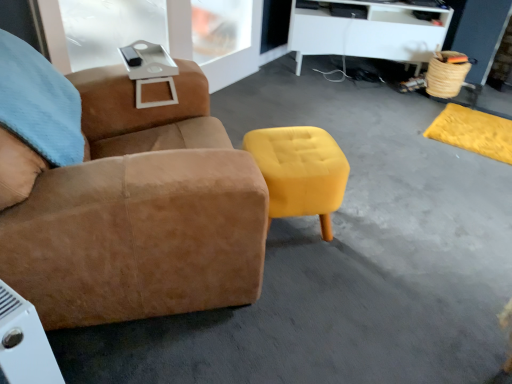
This screenshot has height=384, width=512. What are the coordinates of `vacant region in front of white matte desk at upper center` in the screenshot? It's located at click(x=358, y=112).